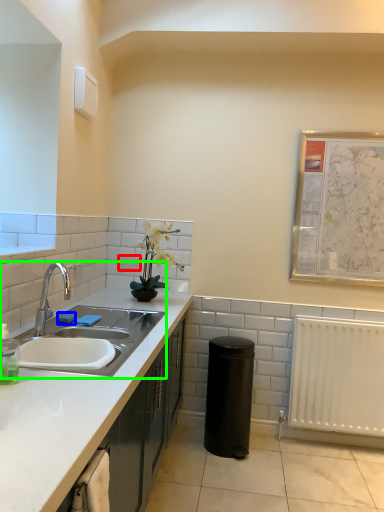
Question: Which object is the closest to the electric outlet (highlighted by a red box)? Choose among these: soap (highlighted by a blue box) or sink (highlighted by a green box).

Choices:
 (A) soap
 (B) sink

Answer: (A)